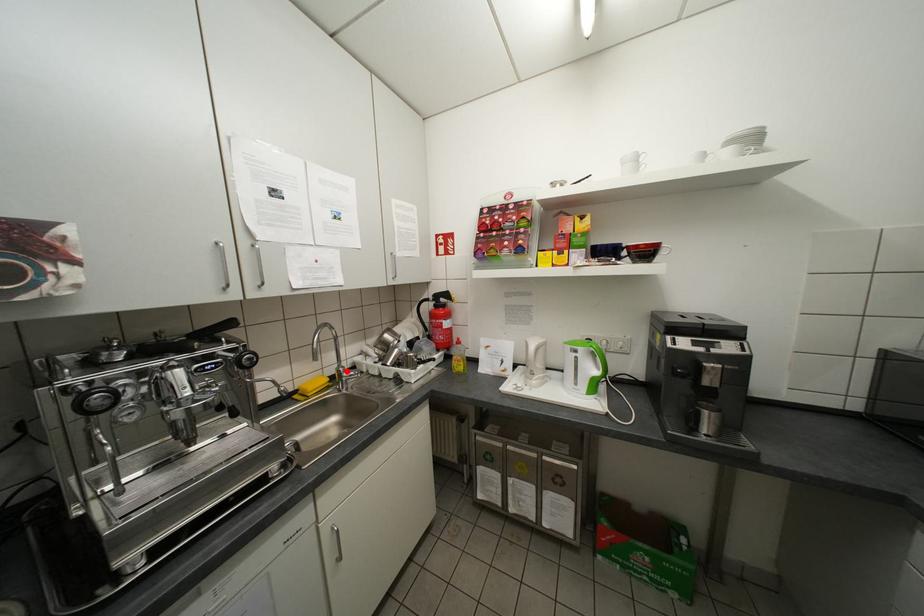
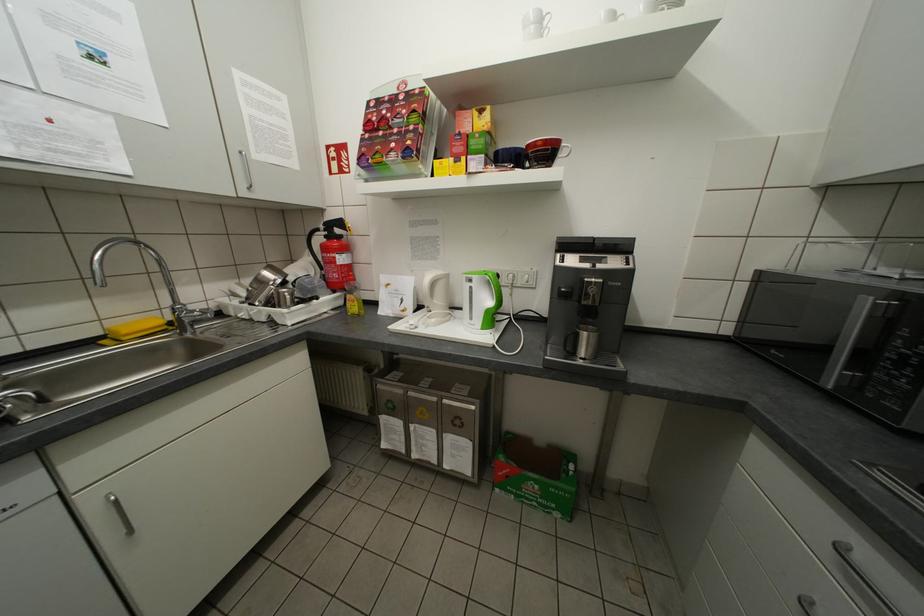
Locate, in the second image, the point that corresponds to the highlighted location in the first image.

(181, 309)